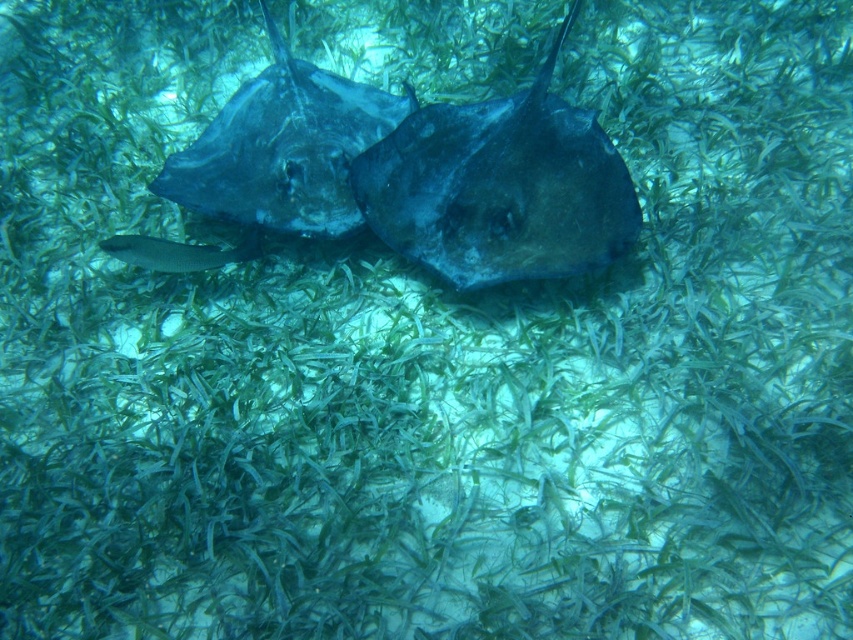
Is dark blue glossy stingray at center above silvery metallic fish at center?

Yes, dark blue glossy stingray at center is above silvery metallic fish at center.

Does dark blue glossy stingray at center lie in front of silvery metallic fish at center?

No, dark blue glossy stingray at center is behind silvery metallic fish at center.

This screenshot has width=853, height=640. What do you see at coordinates (283, 150) in the screenshot?
I see `dark blue glossy stingray at center` at bounding box center [283, 150].

The width and height of the screenshot is (853, 640). Find the location of `dark blue glossy stingray at center`. dark blue glossy stingray at center is located at coordinates (283, 150).

Can you confirm if dark blue matte stingray at center is smaller than silvery metallic fish at center?

Actually, dark blue matte stingray at center might be larger than silvery metallic fish at center.

Which is in front, point (524, 227) or point (151, 252)?

Point (524, 227) is more forward.

In order to click on dark blue matte stingray at center in this screenshot , I will do `click(498, 189)`.

The height and width of the screenshot is (640, 853). Describe the element at coordinates (498, 189) in the screenshot. I see `dark blue matte stingray at center` at that location.

Is point (511, 209) closer to viewer compared to point (258, 205)?

Yes, point (511, 209) is closer to viewer.

Where is `dark blue matte stingray at center`? The width and height of the screenshot is (853, 640). dark blue matte stingray at center is located at coordinates (498, 189).